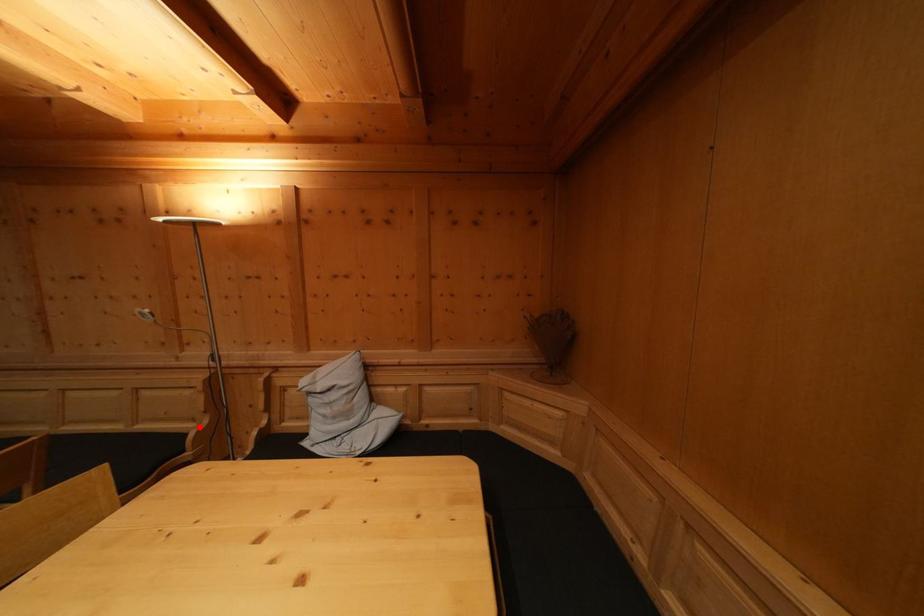
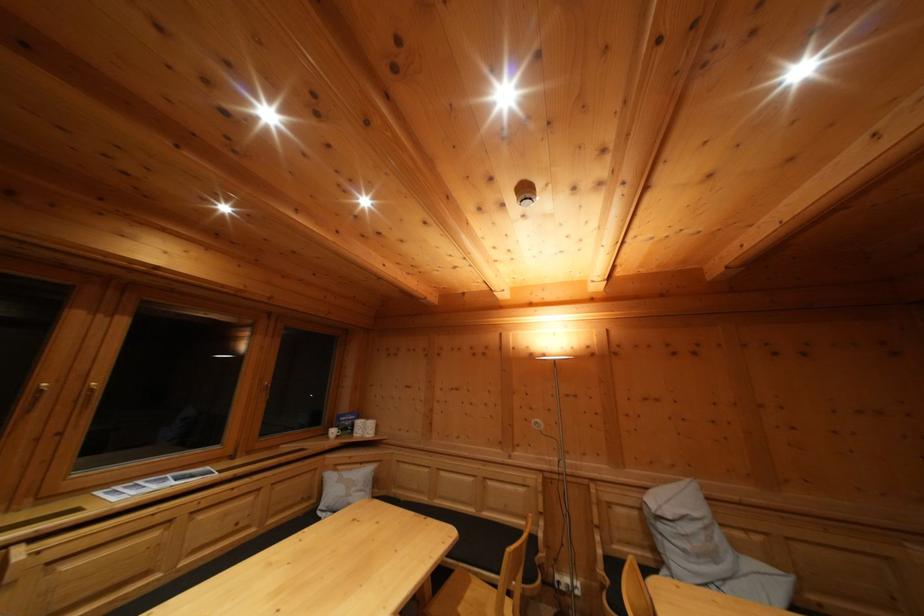
The point at the highlighted location is marked in the first image. Where is the corresponding point in the second image?

(532, 525)